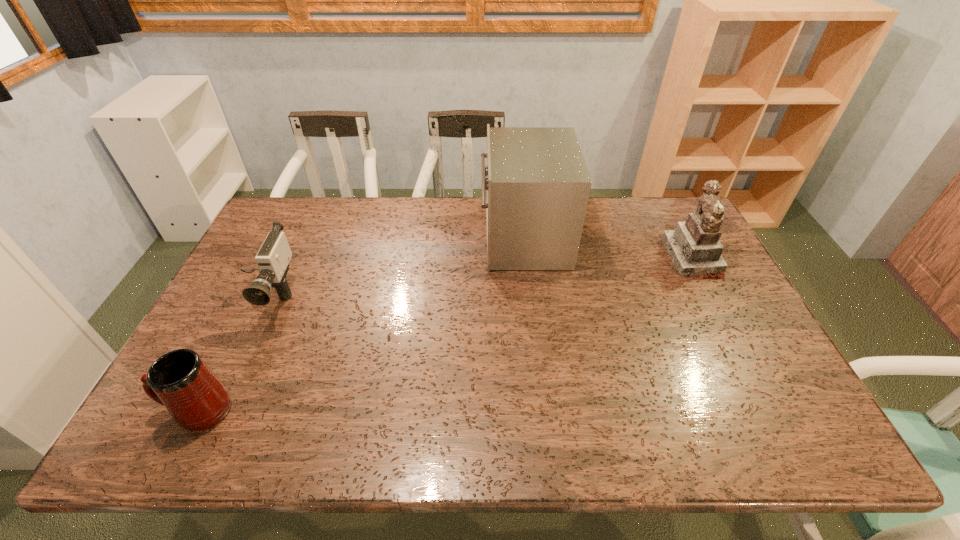
At what (x,y) coordinates should I click in order to perform the action: click on free space between the figurine and the toaster oven. Please return your answer as a coordinate pair (x, y). Looking at the image, I should click on click(608, 248).

This screenshot has width=960, height=540. Find the location of `vacant space that's between the rightmost object and the camcorder`. vacant space that's between the rightmost object and the camcorder is located at coordinates (479, 278).

The image size is (960, 540). I want to click on free space between the third object from left to right and the camcorder, so click(396, 268).

This screenshot has width=960, height=540. I want to click on vacant point located between the second tallest object and the nearest object, so (445, 334).

Find the location of a particular element. free spot between the nearest object and the camcorder is located at coordinates (232, 354).

This screenshot has width=960, height=540. Find the location of `unoccupied position between the tallest object and the rightmost object`. unoccupied position between the tallest object and the rightmost object is located at coordinates (608, 248).

In order to click on object that is the third closest to the nearest object in this screenshot , I will do `click(694, 247)`.

Select which object appears as the closest to the camcorder. Please provide its 2D coordinates. Your answer should be formatted as a tuple, i.e. [(x, y)], where the tuple contains the x and y coordinates of a point satisfying the conditions above.

[(180, 380)]

Identify the location of free space that satisfies the following two spatial constraints: 1. on the front panel of the tallest object; 2. on the recording direction of the camcorder. This screenshot has height=540, width=960. point(531,298).

Locate an element on the screen. free space in the image that satisfies the following two spatial constraints: 1. on the front-facing side of the second tallest object; 2. on the recording direction of the camcorder is located at coordinates (712, 298).